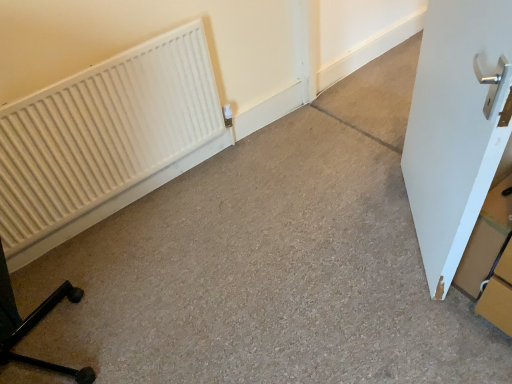
Question: Can you confirm if white matte radiator at left is thinner than white matte door at right?

Choices:
 (A) yes
 (B) no

Answer: (A)

Question: Considering the relative sizes of white matte radiator at left and white matte door at right in the image provided, is white matte radiator at left shorter than white matte door at right?

Choices:
 (A) no
 (B) yes

Answer: (B)

Question: Does white matte radiator at left appear on the left side of white matte door at right?

Choices:
 (A) no
 (B) yes

Answer: (B)

Question: Considering the relative sizes of white matte radiator at left and white matte door at right in the image provided, is white matte radiator at left wider than white matte door at right?

Choices:
 (A) yes
 (B) no

Answer: (B)

Question: From the image's perspective, is white matte radiator at left over white matte door at right?

Choices:
 (A) no
 (B) yes

Answer: (A)

Question: Would you say cardboard box at right is to the left or to the right of white matte radiator at left in the picture?

Choices:
 (A) left
 (B) right

Answer: (B)

Question: Is point (507, 238) positioned closer to the camera than point (59, 170)?

Choices:
 (A) farther
 (B) closer

Answer: (B)

Question: In the image, is cardboard box at right positioned in front of or behind white matte radiator at left?

Choices:
 (A) front
 (B) behind

Answer: (A)

Question: From a real-world perspective, is cardboard box at right above or below white matte radiator at left?

Choices:
 (A) above
 (B) below

Answer: (B)

Question: From the image's perspective, relative to white matte door at right, is cardboard box at right above or below?

Choices:
 (A) above
 (B) below

Answer: (B)

Question: Looking at the image, does cardboard box at right seem bigger or smaller compared to white matte door at right?

Choices:
 (A) small
 (B) big

Answer: (A)

Question: Relative to white matte door at right, is cardboard box at right in front or behind?

Choices:
 (A) behind
 (B) front

Answer: (A)

Question: Is cardboard box at right to the left or to the right of white matte door at right in the image?

Choices:
 (A) left
 (B) right

Answer: (B)

Question: Relative to cardboard box at right, is white matte radiator at left in front or behind?

Choices:
 (A) front
 (B) behind

Answer: (B)

Question: From the image's perspective, is white matte radiator at left positioned above or below cardboard box at right?

Choices:
 (A) above
 (B) below

Answer: (A)